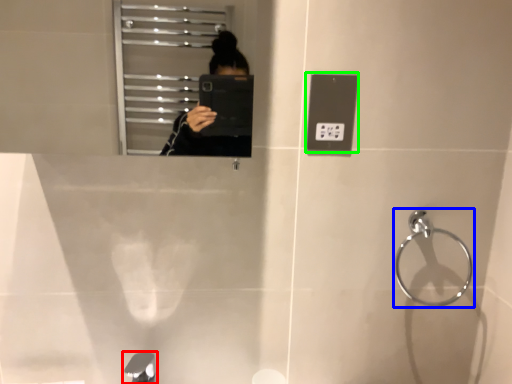
Question: Which object is the closest to the tap (highlighted by a red box)? Choose among these: towel bar (highlighted by a blue box) or light switch (highlighted by a green box).

Choices:
 (A) towel bar
 (B) light switch

Answer: (B)